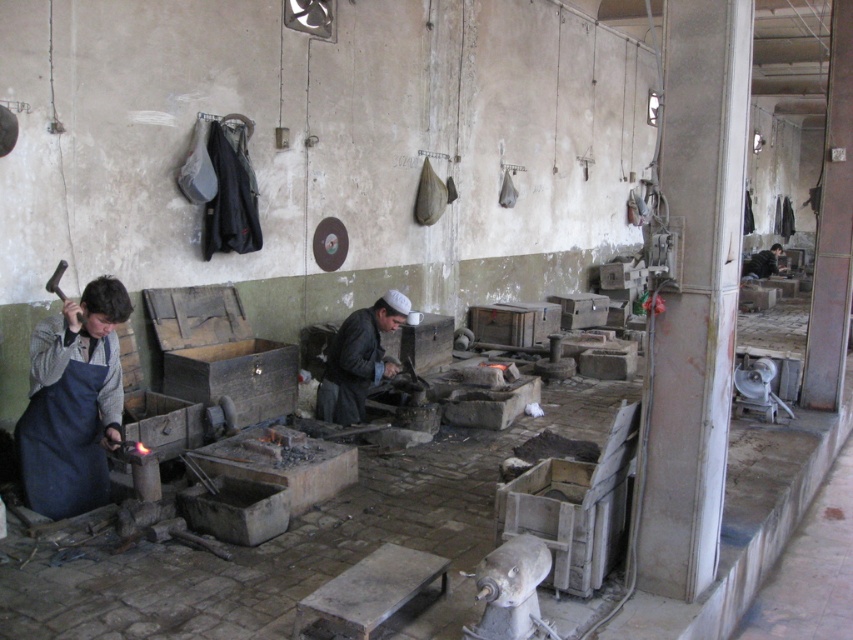
Question: Does blue apron at left have a lesser width compared to dark blue apron at center?

Choices:
 (A) yes
 (B) no

Answer: (A)

Question: Which of the following is the closest to the observer?

Choices:
 (A) blue apron at left
 (B) dark gray leather jacket at center
 (C) dark blue apron at center

Answer: (A)

Question: Which object is positioned farthest from the dark gray leather jacket at center?

Choices:
 (A) dark blue apron at center
 (B) blue apron at left

Answer: (A)

Question: Which of the following is the closest to the observer?

Choices:
 (A) (755, 260)
 (B) (360, 419)
 (C) (45, 403)

Answer: (C)

Question: Can you confirm if blue apron at left is positioned to the left of dark blue apron at center?

Choices:
 (A) yes
 (B) no

Answer: (A)

Question: Does blue apron at left appear on the right side of dark blue apron at center?

Choices:
 (A) no
 (B) yes

Answer: (A)